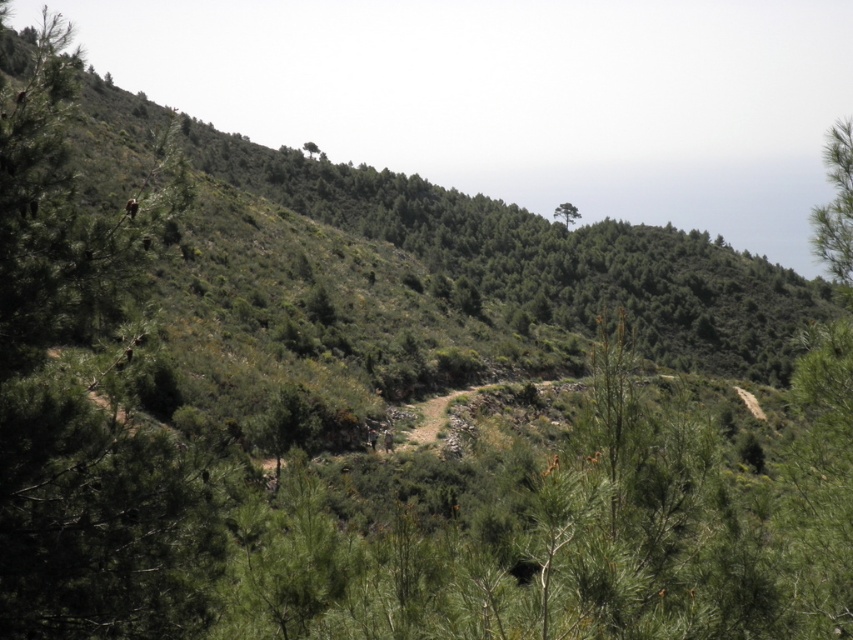
Question: Which point is farther to the camera?

Choices:
 (A) (846, 172)
 (B) (567, 216)

Answer: (B)

Question: Can you confirm if green leafy tree at upper right is positioned to the right of green leafy tree at upper center?

Choices:
 (A) yes
 (B) no

Answer: (A)

Question: Is green leafy tree at upper right positioned behind green leafy tree at upper center?

Choices:
 (A) no
 (B) yes

Answer: (A)

Question: Can you confirm if green leafy tree at upper right is thinner than green leafy tree at upper center?

Choices:
 (A) no
 (B) yes

Answer: (A)